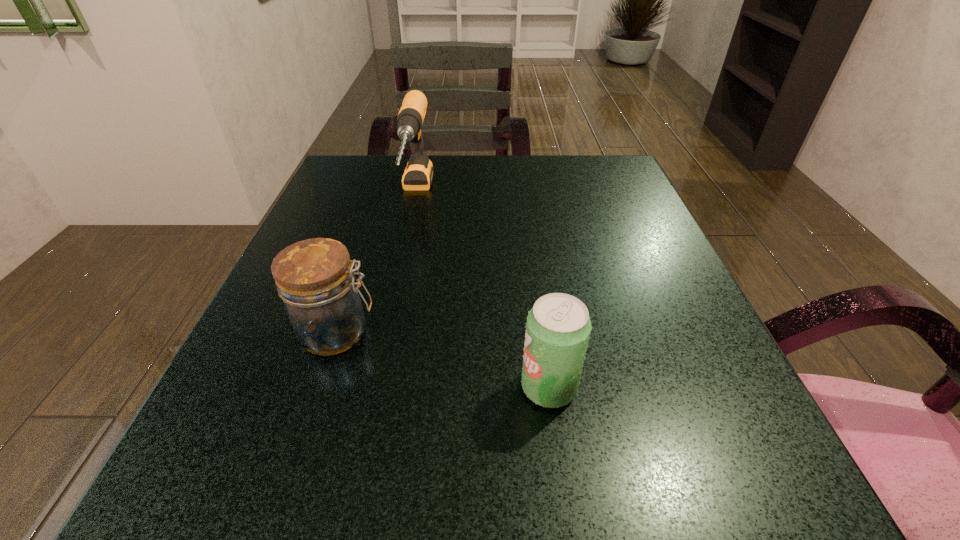
Locate an element on the screen. empty space that is in between the rightmost object and the drill is located at coordinates (482, 291).

Identify the location of vacant space that is in between the farthest object and the soda. The height and width of the screenshot is (540, 960). (482, 291).

Find the location of a particular element. The image size is (960, 540). vacant region between the soda and the tallest object is located at coordinates (482, 291).

Where is `unoccupied area between the tallest object and the rightmost object`? unoccupied area between the tallest object and the rightmost object is located at coordinates (482, 291).

Identify the location of vacant space in between the rightmost object and the drill. The image size is (960, 540). (482, 291).

Find the location of a particular element. Image resolution: width=960 pixels, height=540 pixels. unoccupied position between the jar and the tallest object is located at coordinates (376, 264).

This screenshot has height=540, width=960. Find the location of `free space between the farthest object and the second nearest object`. free space between the farthest object and the second nearest object is located at coordinates (376, 264).

Point out which object is positioned as the second nearest to the farthest object. Please provide its 2D coordinates. Your answer should be formatted as a tuple, i.e. [(x, y)], where the tuple contains the x and y coordinates of a point satisfying the conditions above.

[(558, 327)]

Where is `the second closest object relative to the drill`? The height and width of the screenshot is (540, 960). the second closest object relative to the drill is located at coordinates (558, 327).

The width and height of the screenshot is (960, 540). I want to click on vacant space that satisfies the following two spatial constraints: 1. on the lid of the rightmost object; 2. on the left side of the jar, so [320, 387].